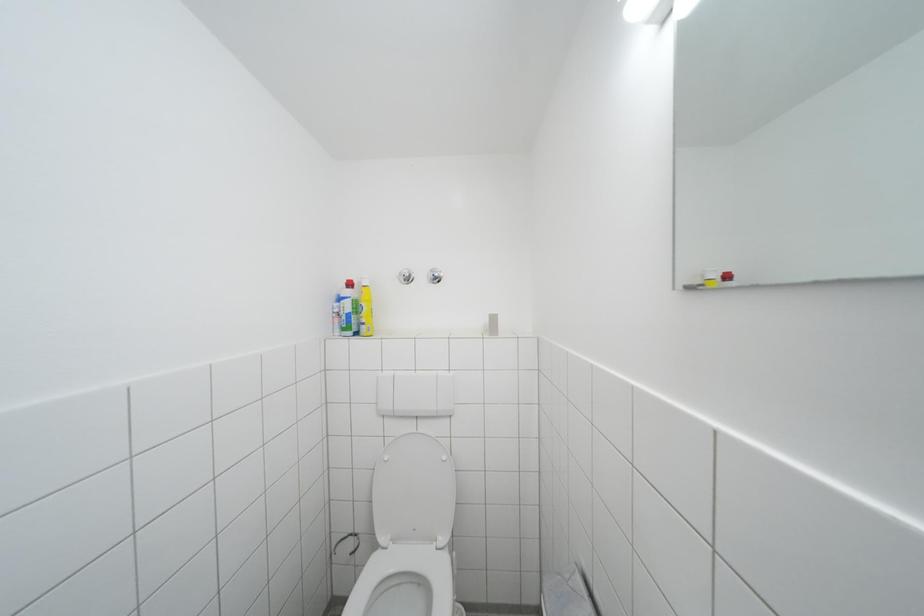
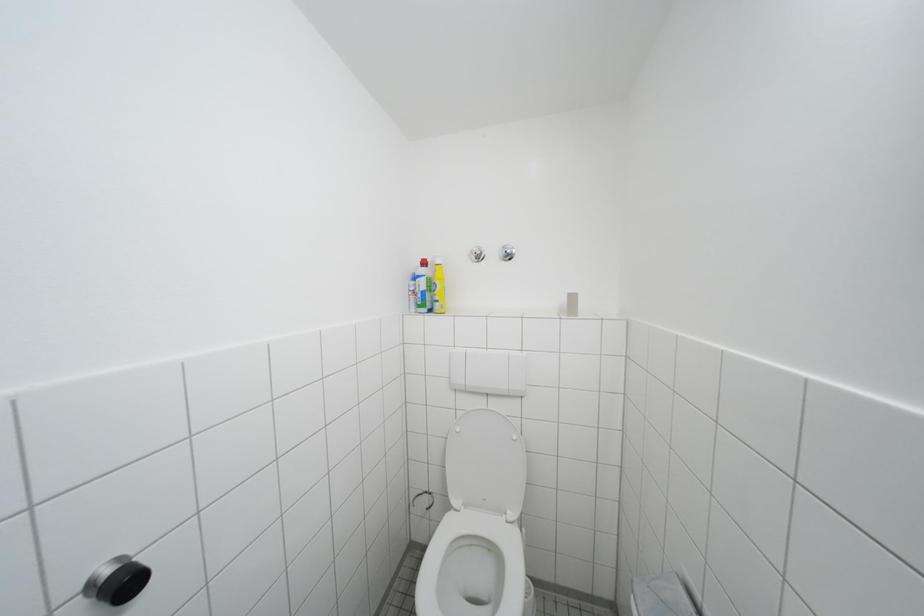
Question: The first image is from the beginning of the video and the second image is from the end. How did the camera likely rotate when shooting the video?

Choices:
 (A) Left
 (B) Right
 (C) Up
 (D) Down

Answer: (A)